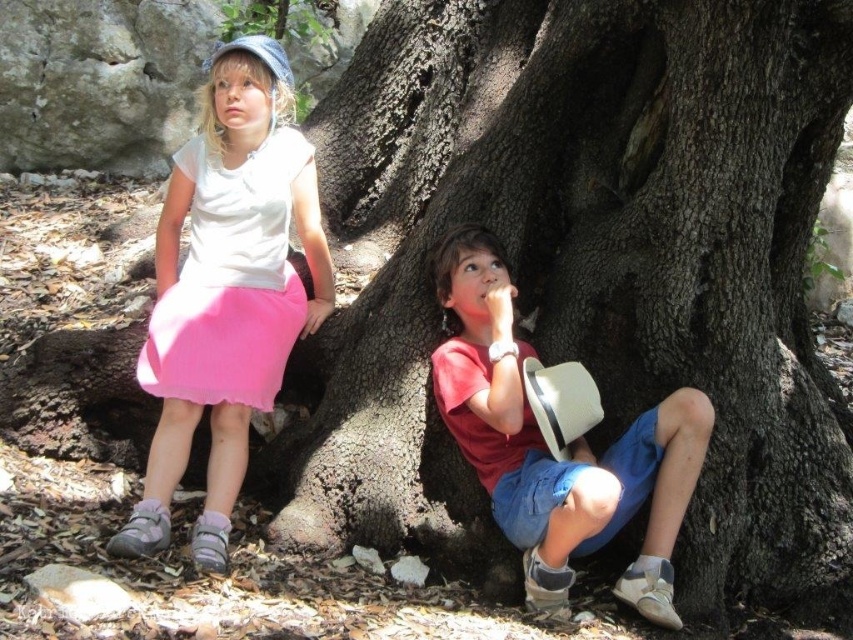
Is rough bark tree at center to the right of matte pink skirt at left from the viewer's perspective?

Yes, rough bark tree at center is to the right of matte pink skirt at left.

Can you confirm if rough bark tree at center is positioned above matte pink skirt at left?

Incorrect, rough bark tree at center is not positioned above matte pink skirt at left.

Consider the image. Who is more forward, [503,157] or [164,545]?

Point [164,545] is more forward.

Find the location of a particular element. rough bark tree at center is located at coordinates (589, 269).

Is matte pink skirt at left smaller than matte red shirt at center?

Actually, matte pink skirt at left might be larger than matte red shirt at center.

Is matte pink skirt at left below matte red shirt at center?

No, matte pink skirt at left is not below matte red shirt at center.

Is point (202, 157) positioned after point (467, 410)?

Yes, it is.

Where is `matte pink skirt at left`? The image size is (853, 640). matte pink skirt at left is located at coordinates (227, 289).

Describe the element at coordinates (589, 269) in the screenshot. I see `rough bark tree at center` at that location.

What are the coordinates of `rough bark tree at center` in the screenshot? It's located at (589, 269).